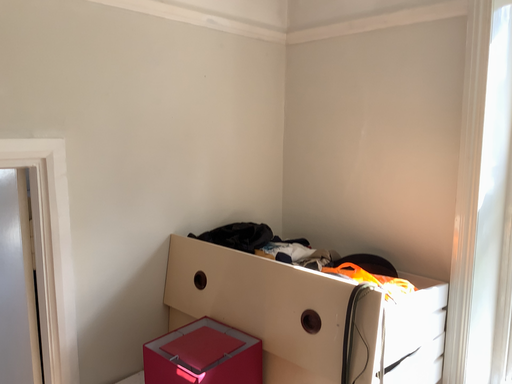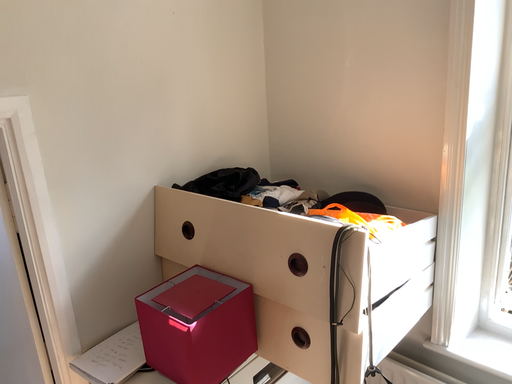
Question: How did the camera likely rotate when shooting the video?

Choices:
 (A) rotated downward
 (B) rotated upward

Answer: (A)